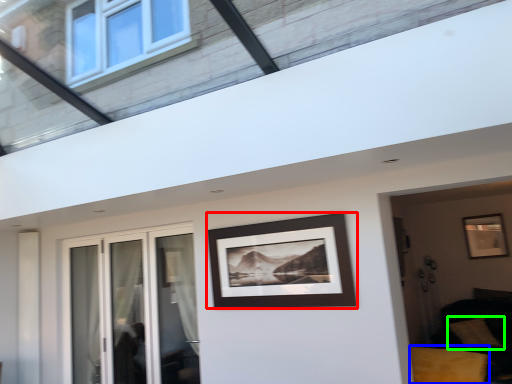
Question: Which object is the farthest from picture frame (highlighted by a red box)? Choose among these: furniture (highlighted by a blue box) or pillow (highlighted by a green box).

Choices:
 (A) furniture
 (B) pillow

Answer: (B)